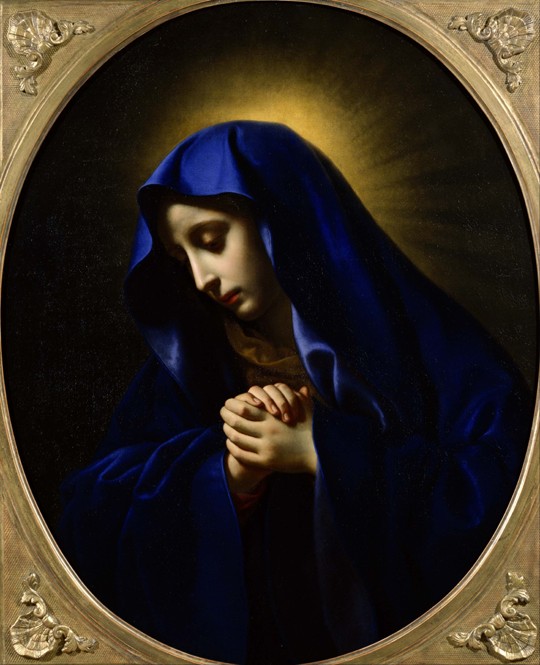
Find the location of a particular element. The width and height of the screenshot is (540, 665). ornaments is located at coordinates (32, 48), (35, 618), (509, 630), (506, 44).